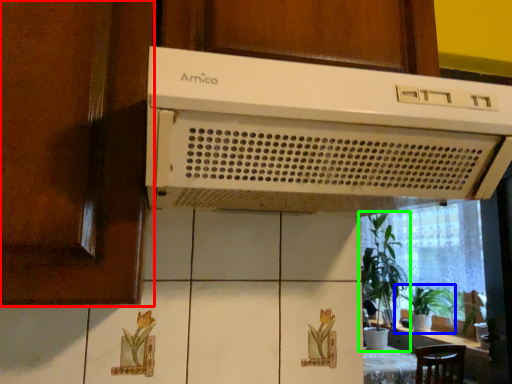
Question: Based on their relative distances, which object is farther from screen door (highlighted by a red box)? Choose from houseplant (highlighted by a blue box) and houseplant (highlighted by a green box).

Choices:
 (A) houseplant
 (B) houseplant

Answer: (A)